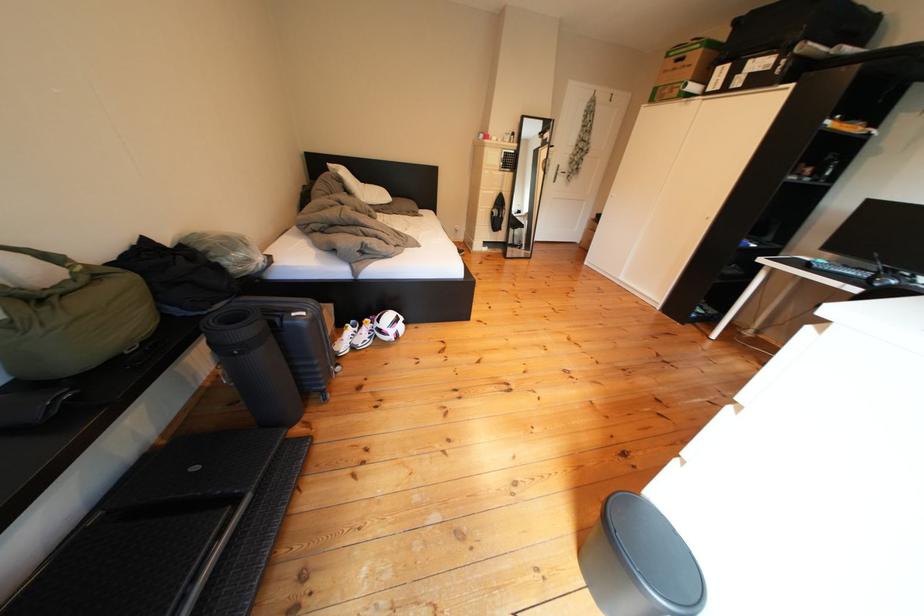
Where would you click the black computer mouse? Please return your answer as a coordinate pair (x, y).

(881, 280)